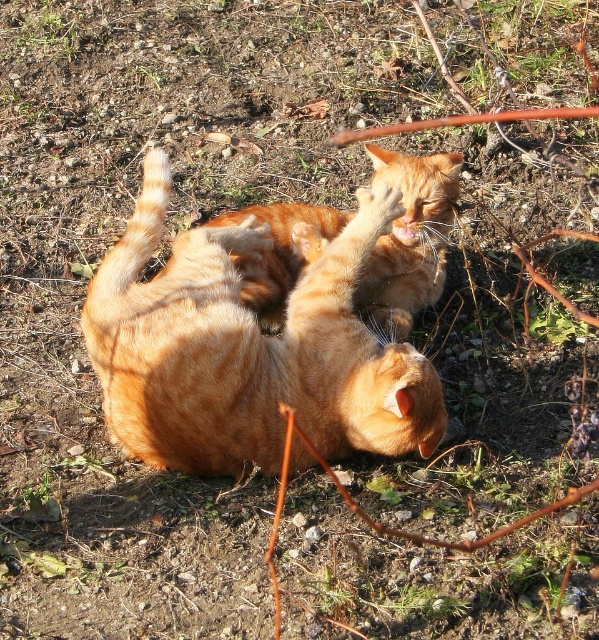
Does orange fur cat at center have a larger size compared to orange tabby cat at center?

Correct, orange fur cat at center is larger in size than orange tabby cat at center.

Does orange fur cat at center appear under orange tabby cat at center?

Indeed, orange fur cat at center is positioned under orange tabby cat at center.

Does point (352, 376) come behind point (313, 208)?

That is False.

What are the coordinates of `orange fur cat at center` in the screenshot? It's located at (249, 348).